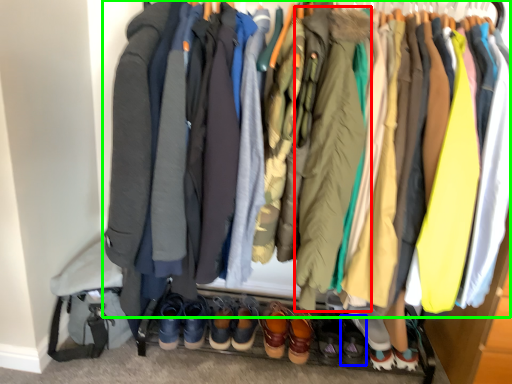
Question: Considering the real-world distances, which object is closest to jacket (highlighted by a red box)? footwear (highlighted by a blue box) or jacket (highlighted by a green box).

Choices:
 (A) footwear
 (B) jacket

Answer: (A)